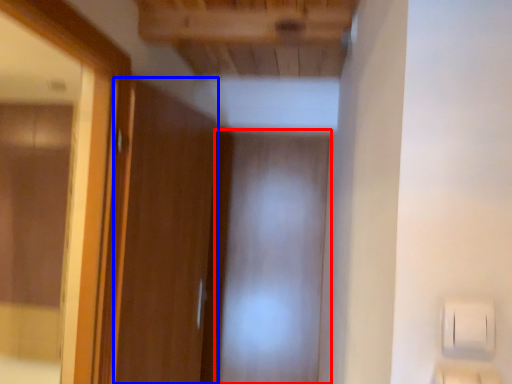
Question: Which of the following is the closest to the observer, screen door (highlighted by a red box) or door (highlighted by a blue box)?

Choices:
 (A) screen door
 (B) door

Answer: (B)